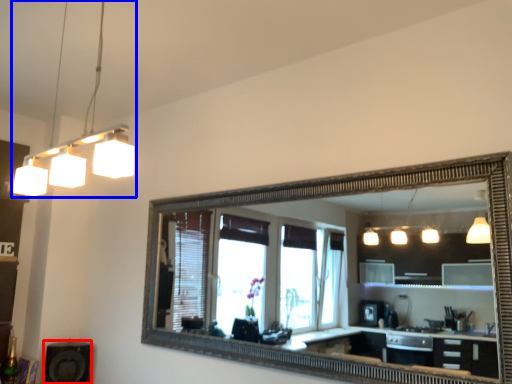
Question: Which object is further to the camera taking this photo, speaker (highlighted by a red box) or light fixture (highlighted by a blue box)?

Choices:
 (A) speaker
 (B) light fixture

Answer: (A)